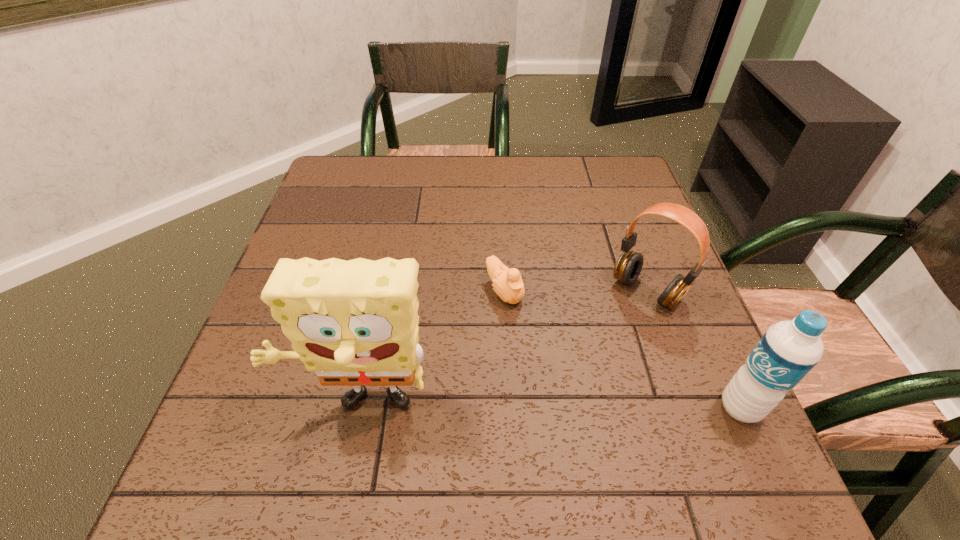
This screenshot has height=540, width=960. Find the location of `free space on the desktop that is between the tallest object and the water bottle and is positioned on the face of the duckling`. free space on the desktop that is between the tallest object and the water bottle and is positioned on the face of the duckling is located at coordinates click(598, 407).

At what (x,y) coordinates should I click in order to perform the action: click on vacant space on the desktop that is between the sponge and the water bottle and is positioned on the ear cups of the headset. Please return your answer as a coordinate pair (x, y). This screenshot has height=540, width=960. Looking at the image, I should click on (541, 407).